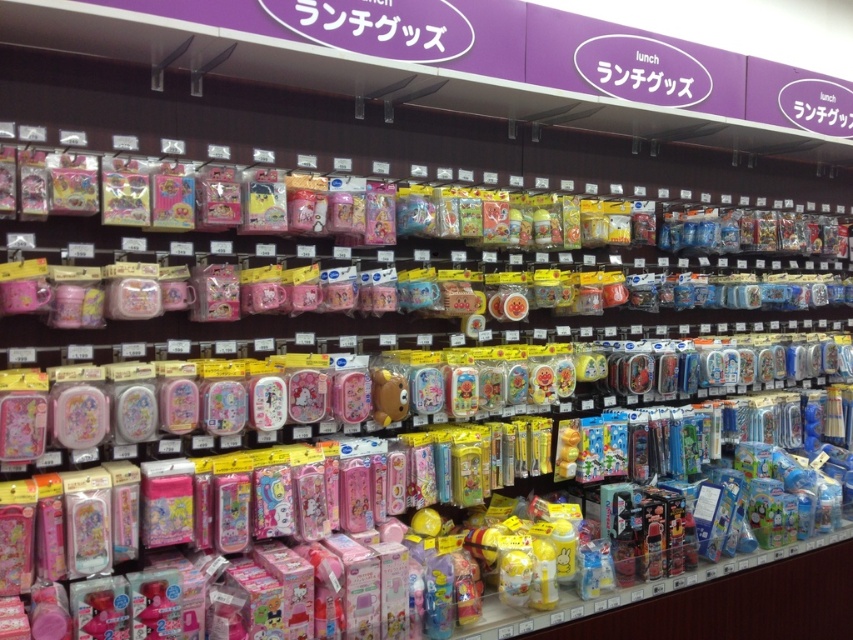
Between point (389, 378) and point (469, 413), which one is positioned in front?

Point (389, 378)

Does matte brown bear at center have a lesser width compared to translucent plastic bear at center?

No, matte brown bear at center is not thinner than translucent plastic bear at center.

Is point (401, 388) more distant than point (471, 372)?

No.

Locate an element on the screen. matte brown bear at center is located at coordinates pyautogui.click(x=387, y=396).